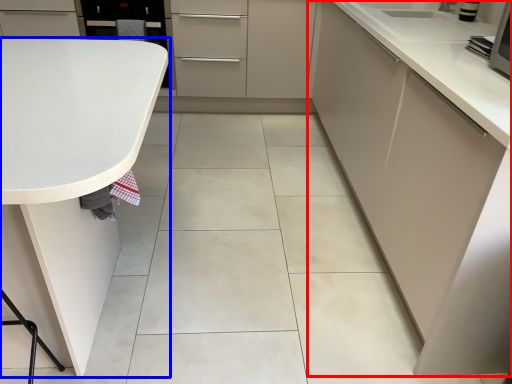
Question: Which of the following is the closest to the observer, cabinetry (highlighted by a red box) or countertop (highlighted by a blue box)?

Choices:
 (A) cabinetry
 (B) countertop

Answer: (B)